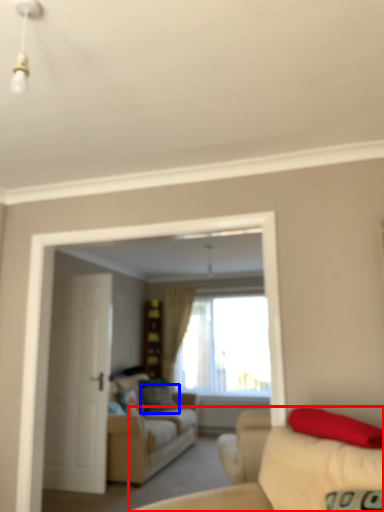
Question: Among these objects, which one is farthest to the camera, studio couch (highlighted by a red box) or pillow (highlighted by a blue box)?

Choices:
 (A) studio couch
 (B) pillow

Answer: (B)